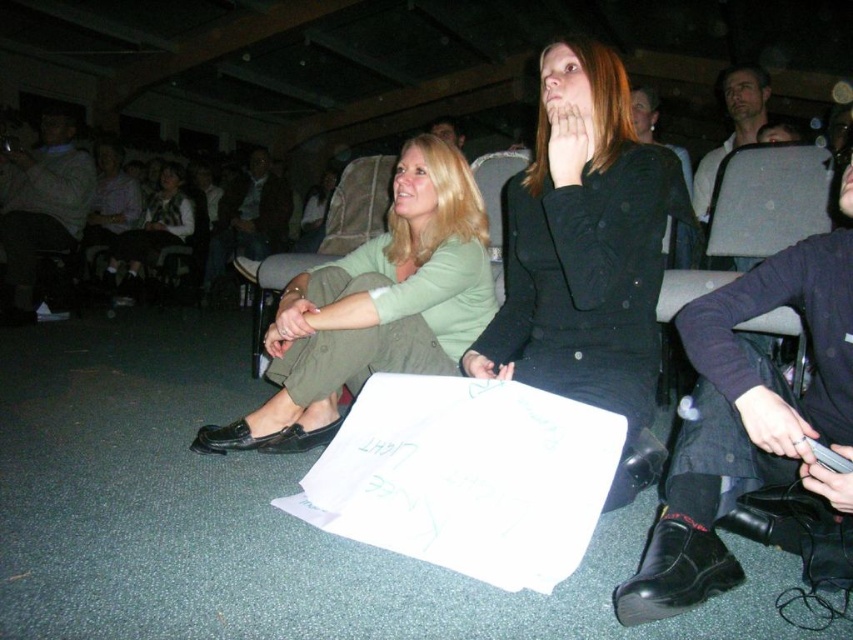
Question: Which object is farther from the camera taking this photo?

Choices:
 (A) matte green fabric chair at center
 (B) green matte shirt at center
 (C) light brown leather jacket at upper left

Answer: (C)

Question: Estimate the real-world distances between objects in this image. Which object is closer to the black leather jacket at upper center?

Choices:
 (A) green matte shirt at center
 (B) light green fabric jacket at center

Answer: (A)

Question: Can you confirm if light brown leather jacket at upper left is positioned to the right of light purple shirt at upper left?

Choices:
 (A) no
 (B) yes

Answer: (B)

Question: Among these objects, which one is nearest to the camera?

Choices:
 (A) dark brown leather jacket at center
 (B) light brown leather jacket at upper left
 (C) green matte shirt at center
 (D) light purple shirt at upper left

Answer: (C)

Question: Can you confirm if light green fabric jacket at center is positioned below black leather jacket at upper center?

Choices:
 (A) yes
 (B) no

Answer: (B)

Question: In this image, where is green matte shirt at center located relative to light purple shirt at upper left?

Choices:
 (A) right
 (B) left

Answer: (A)